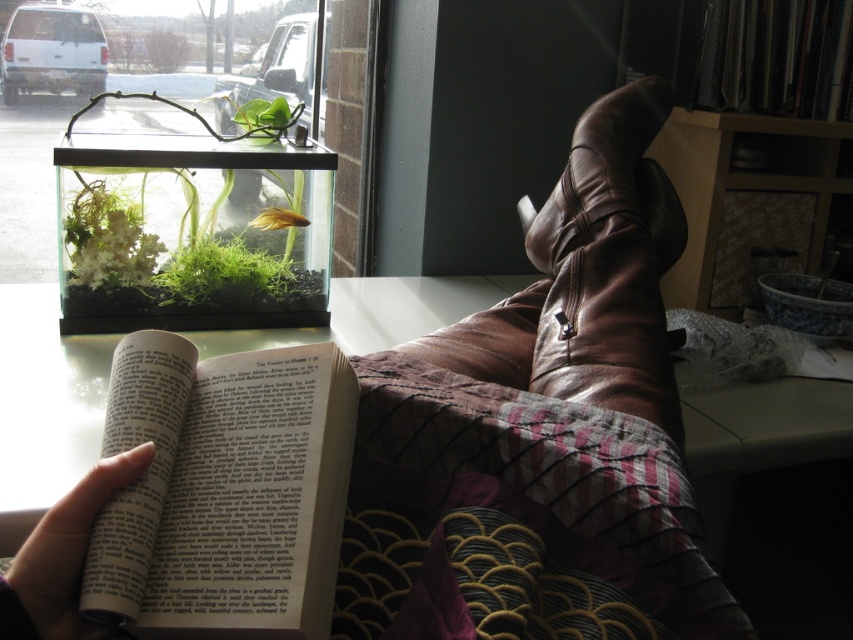
You are a person who wants to place a new decorative item between the paperback book at center and the green mossy plant at upper left. Based on their positions, where should you place the item to ensure it is between them?

The paperback book at center is to the right of the green mossy plant at upper left, so placing the item between them would require positioning it to the right of the green mossy plant at upper left and to the left of the paperback book at center.

You are standing in the room and see two points marked in the image. Which point is closer to you, point (283, 426) or point (171, 289)?

Point (283, 426) is in front of point (171, 289), so it is closer to you.

You are a delivery robot that needs to place a package between the paperback book at center and the green mossy plant at upper left. The package is 15 inches long. Can you fit it in the space between them?

The distance between the paperback book at center and the green mossy plant at upper left is 33.59 inches, so yes, the package can fit since it is shorter than the available space.